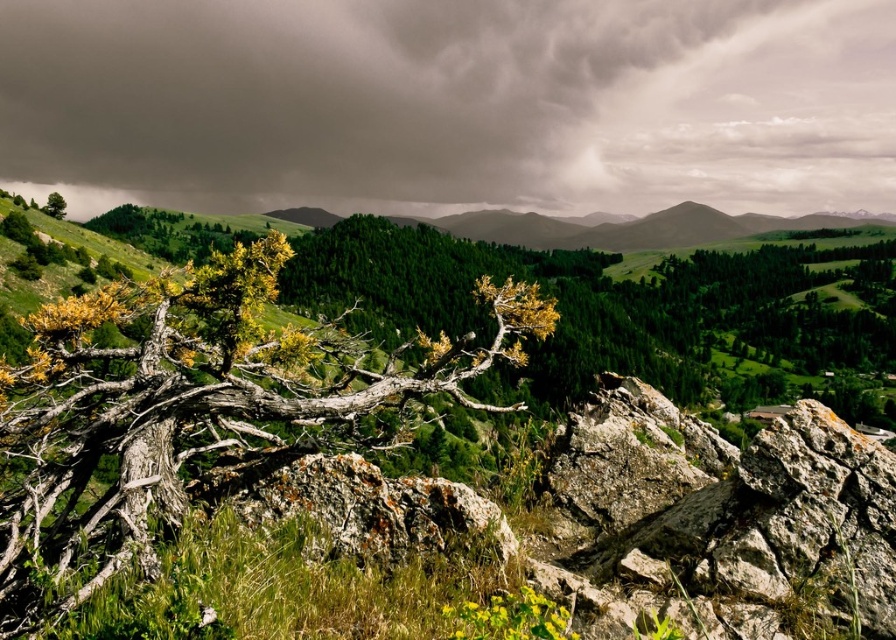
Question: Which point is closer to the camera taking this photo?

Choices:
 (A) (360, 486)
 (B) (303, 381)
 (C) (445, 108)
 (D) (634, 435)

Answer: (A)

Question: Which object is the farthest from the green leafy tree at upper left?

Choices:
 (A) gray bark tree at center
 (B) rusty stone rock at lower right
 (C) rusty rock at center
 (D) dark gray cloud at upper center

Answer: (D)

Question: Does gray bark tree at center appear over rusty rock at center?

Choices:
 (A) no
 (B) yes

Answer: (A)

Question: Does rusty stone rock at lower right come in front of rusty rock at center?

Choices:
 (A) no
 (B) yes

Answer: (B)

Question: Which of the following is the closest to the observer?

Choices:
 (A) gray bark tree at center
 (B) rusty stone rock at lower right
 (C) green leafy tree at upper left

Answer: (B)

Question: Can you confirm if dark gray cloud at upper center is positioned to the left of rusty rock at center?

Choices:
 (A) no
 (B) yes

Answer: (A)